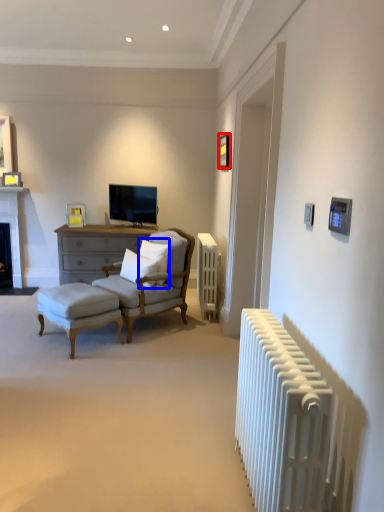
Question: Which point is closer to the camera, picture frame (highlighted by a red box) or pillow (highlighted by a blue box)?

Choices:
 (A) picture frame
 (B) pillow

Answer: (B)